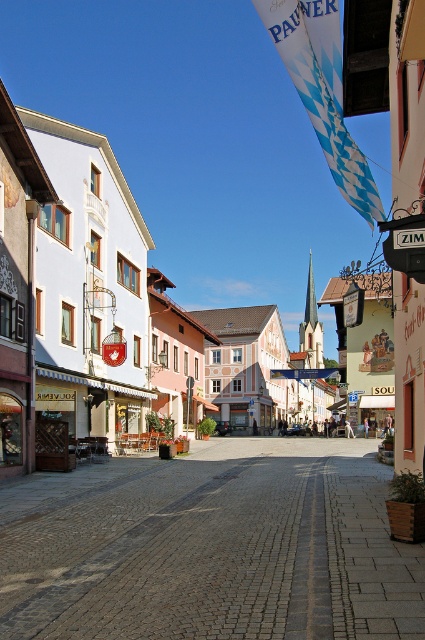
Question: Which point is farther to the camera?

Choices:
 (A) pos(303,508)
 (B) pos(53,376)

Answer: (B)

Question: Which of the following is the closest to the observer?

Choices:
 (A) white painted building at left
 (B) cobblestone street at center

Answer: (B)

Question: Does cobblestone street at center appear on the left side of white painted building at left?

Choices:
 (A) yes
 (B) no

Answer: (B)

Question: Can you confirm if cobblestone street at center is positioned below white painted building at left?

Choices:
 (A) yes
 (B) no

Answer: (A)

Question: Is cobblestone street at center positioned at the back of white painted building at left?

Choices:
 (A) no
 (B) yes

Answer: (A)

Question: Which of the following is the closest to the observer?

Choices:
 (A) (71, 417)
 (B) (48, 556)

Answer: (B)